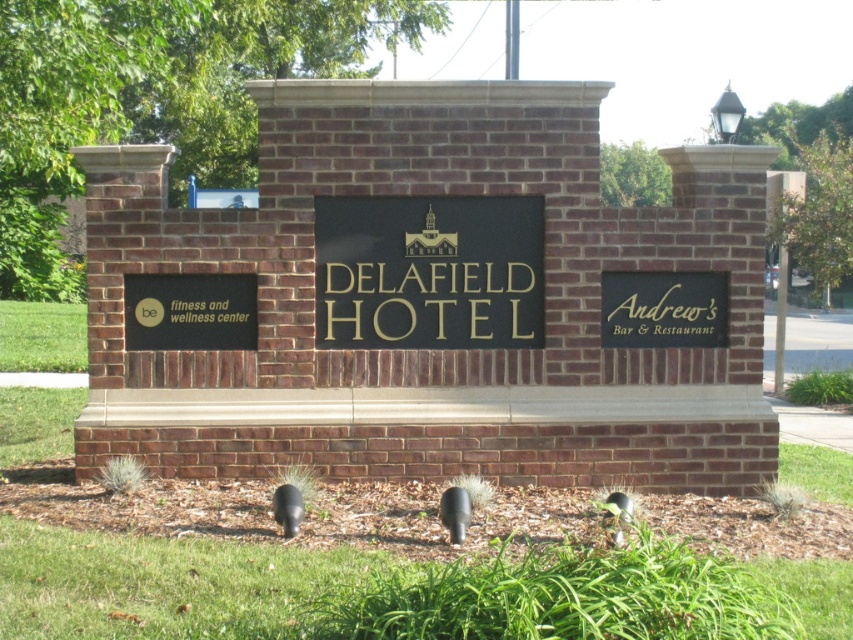
Can you confirm if black matte sign at lower left is shorter than black matte sign at right?

Yes, black matte sign at lower left is shorter than black matte sign at right.

Between black matte sign at lower left and black matte sign at right, which one appears on the left side from the viewer's perspective?

black matte sign at lower left

Does point (132, 285) lie in front of point (625, 317)?

Yes, it is in front of point (625, 317).

Identify the location of black matte sign at lower left. (190, 310).

What do you see at coordinates (428, 272) in the screenshot?
I see `goldmaterial/texture sign at center` at bounding box center [428, 272].

Measure the distance between goldmaterial/texture sign at center and camera.

goldmaterial/texture sign at center and camera are 7.82 meters apart from each other.

The height and width of the screenshot is (640, 853). Find the location of `goldmaterial/texture sign at center`. goldmaterial/texture sign at center is located at coordinates (428, 272).

Measure the distance from goldmaterial/texture sign at center to black matte sign at lower left.

goldmaterial/texture sign at center and black matte sign at lower left are 34.69 inches apart from each other.

Is goldmaterial/texture sign at center above black matte sign at lower left?

Yes.

What do you see at coordinates (428, 272) in the screenshot?
I see `goldmaterial/texture sign at center` at bounding box center [428, 272].

Locate an element on the screen. The width and height of the screenshot is (853, 640). goldmaterial/texture sign at center is located at coordinates (428, 272).